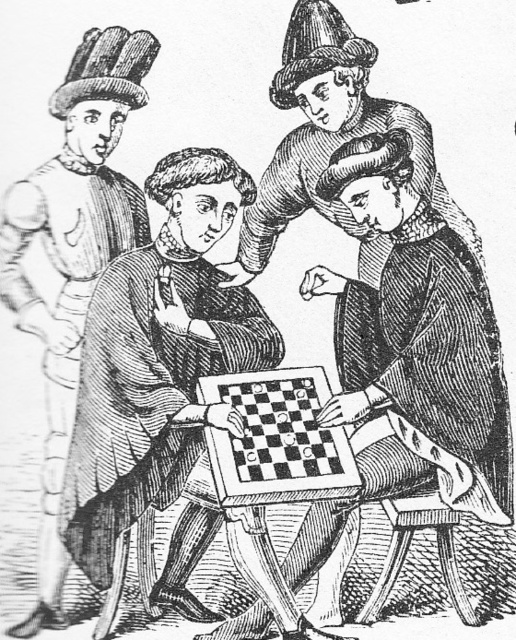
Question: Can you confirm if smooth leather hat at left is positioned to the right of black wood chessboard at center?

Choices:
 (A) no
 (B) yes

Answer: (A)

Question: Can you confirm if smooth brown robe at center is wider than black wood chessboard at center?

Choices:
 (A) no
 (B) yes

Answer: (B)

Question: Which point appears farthest from the camera in this image?

Choices:
 (A) [10, 301]
 (B) [249, 620]

Answer: (A)

Question: Considering the relative positions of smooth leather hat at left and black wood chessboard at center in the image provided, where is smooth leather hat at left located with respect to black wood chessboard at center?

Choices:
 (A) below
 (B) above

Answer: (B)

Question: Which object is the farthest from the smooth leather hat at left?

Choices:
 (A) smooth brown robe at center
 (B) black wood chessboard at center

Answer: (A)

Question: Estimate the real-world distances between objects in this image. Which object is farther from the smooth leather hat at left?

Choices:
 (A) smooth brown robe at center
 (B) black wood chessboard at center

Answer: (A)